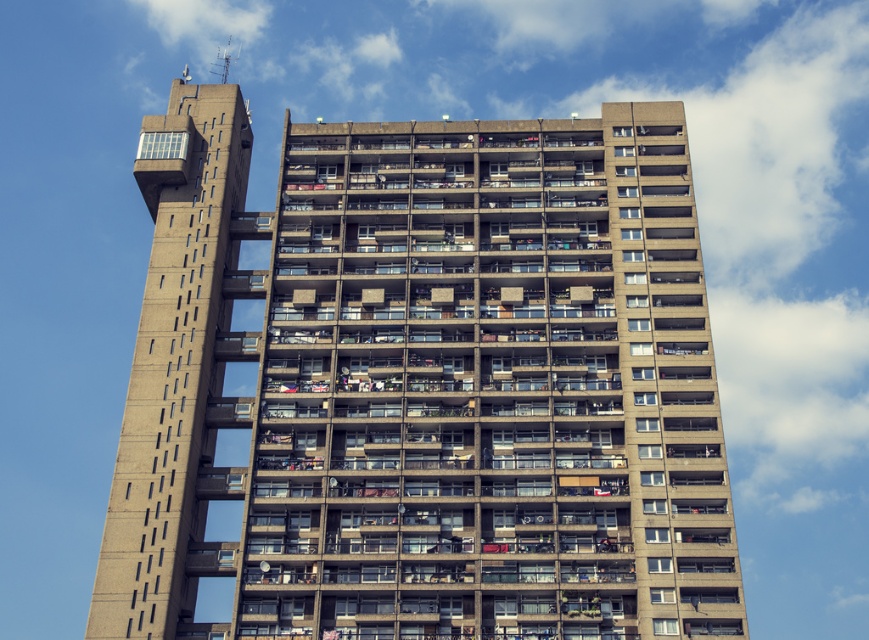
Based on the photo, who is shorter, concrete building at center or concrete tower at upper left?

concrete building at center is shorter.

How far apart are concrete building at center and concrete tower at upper left?

concrete building at center and concrete tower at upper left are 37.19 feet apart from each other.

Between point (567, 497) and point (170, 388), which one is positioned in front?

Point (567, 497) is in front.

At what (x,y) coordinates should I click in order to perform the action: click on concrete building at center. Please return your answer as a coordinate pair (x, y). Looking at the image, I should click on (488, 387).